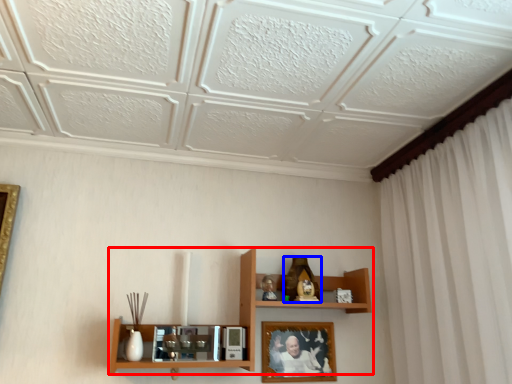
Question: Which object appears farthest to the camera in this image, shelf (highlighted by a red box) or toy (highlighted by a blue box)?

Choices:
 (A) shelf
 (B) toy

Answer: (B)